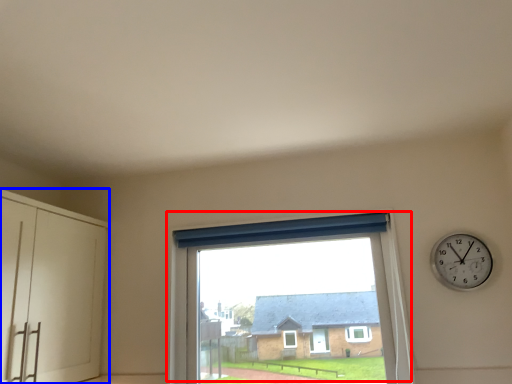
Question: Which object is further to the camera taking this photo, window (highlighted by a red box) or dresser (highlighted by a blue box)?

Choices:
 (A) window
 (B) dresser

Answer: (A)